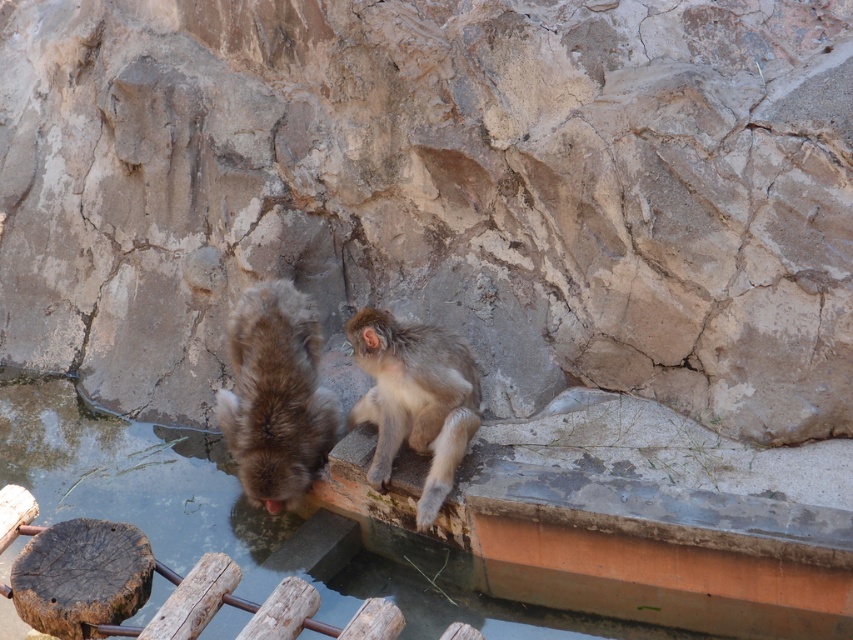
Question: Does fuzzy brown monkey at center lie behind fuzzy gray monkey at center?

Choices:
 (A) no
 (B) yes

Answer: (B)

Question: In this image, where is fuzzy brown monkey at center located relative to fuzzy gray monkey at center?

Choices:
 (A) right
 (B) left

Answer: (B)

Question: Considering the relative positions of clear water at monkey right and fuzzy gray monkey at center in the image provided, where is clear water at monkey right located with respect to fuzzy gray monkey at center?

Choices:
 (A) left
 (B) right

Answer: (A)

Question: Which object appears closest to the camera in this image?

Choices:
 (A) clear water at monkey right
 (B) fuzzy gray monkey at center

Answer: (A)

Question: Which point is closer to the camera?

Choices:
 (A) (270, 483)
 (B) (489, 582)
 (C) (422, 492)

Answer: (C)

Question: Considering the real-world distances, which object is farthest from the fuzzy brown monkey at center?

Choices:
 (A) clear water at monkey right
 (B) fuzzy gray monkey at center

Answer: (A)